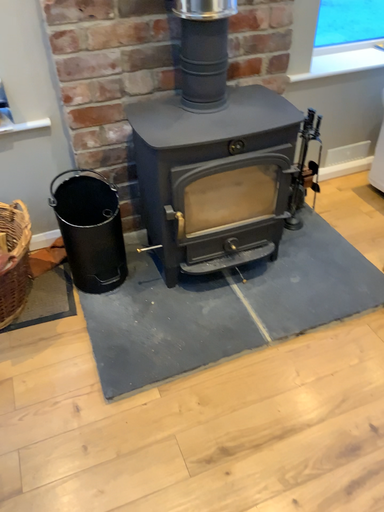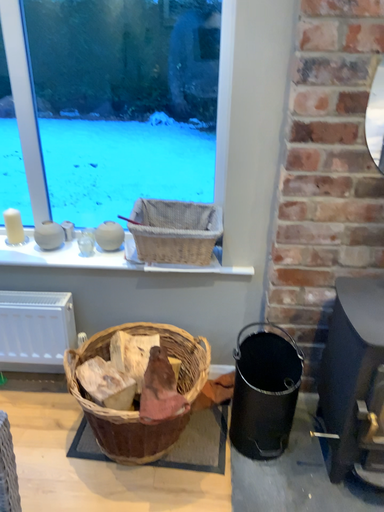
Question: How did the camera likely rotate when shooting the video?

Choices:
 (A) rotated right
 (B) rotated left

Answer: (B)